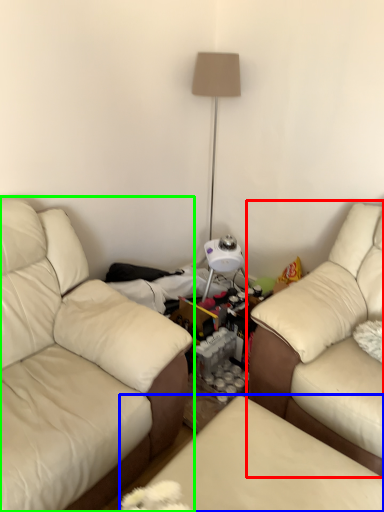
Question: Which object is positioned farthest from studio couch (highlighted by a red box)? Select from swivel chair (highlighted by a blue box) and studio couch (highlighted by a green box).

Choices:
 (A) swivel chair
 (B) studio couch

Answer: (B)